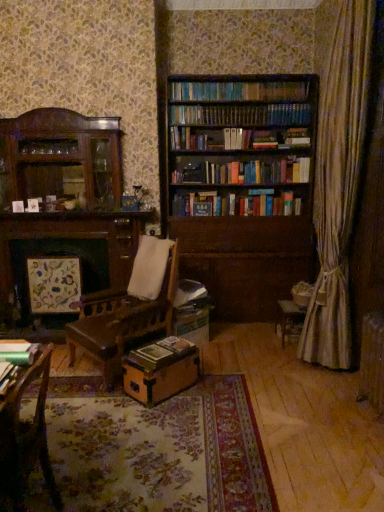
The height and width of the screenshot is (512, 384). In order to click on empty space that is ontop of hardcover book at center, which is counted as the first book, starting from the right (from a real-world perspective) in this screenshot , I will do `click(154, 348)`.